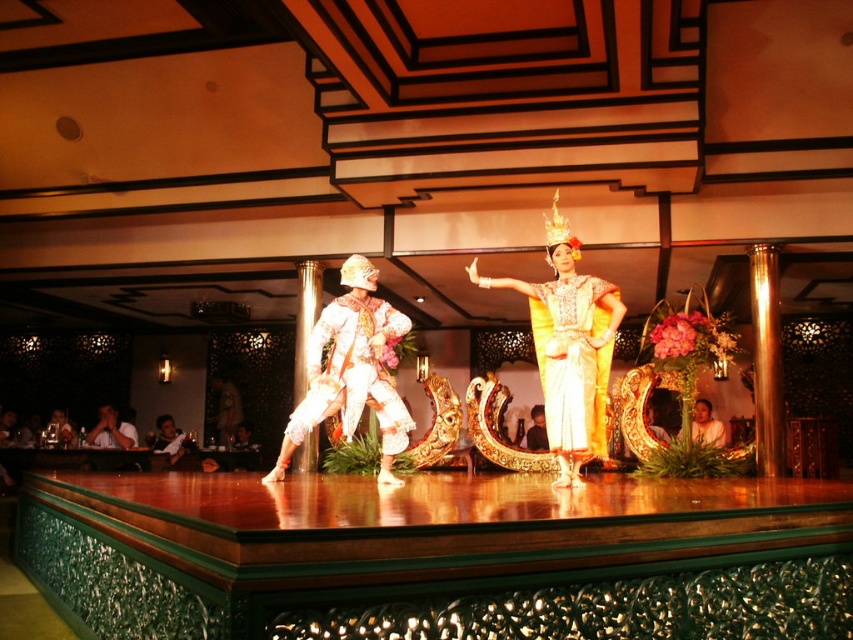
Between white textured fabric at center and golden silk skirt at center, which one is positioned higher?

Positioned higher is white textured fabric at center.

Does point (376, 404) come closer to viewer compared to point (704, 420)?

That is True.

Image resolution: width=853 pixels, height=640 pixels. What do you see at coordinates (352, 371) in the screenshot?
I see `white textured fabric at center` at bounding box center [352, 371].

Locate an element on the screen. This screenshot has width=853, height=640. white textured fabric at center is located at coordinates (352, 371).

Does golden silk dress at center appear over white textured fabric at center?

Correct, golden silk dress at center is located above white textured fabric at center.

Is golden silk dress at center taller than white textured fabric at center?

Correct, golden silk dress at center is much taller as white textured fabric at center.

The image size is (853, 640). What do you see at coordinates (569, 348) in the screenshot? I see `golden silk dress at center` at bounding box center [569, 348].

Locate an element on the screen. Image resolution: width=853 pixels, height=640 pixels. golden silk dress at center is located at coordinates (569, 348).

The height and width of the screenshot is (640, 853). I want to click on gold silk dress at center, so click(573, 362).

What do you see at coordinates (573, 362) in the screenshot? I see `gold silk dress at center` at bounding box center [573, 362].

The image size is (853, 640). Identify the location of gold silk dress at center. (573, 362).